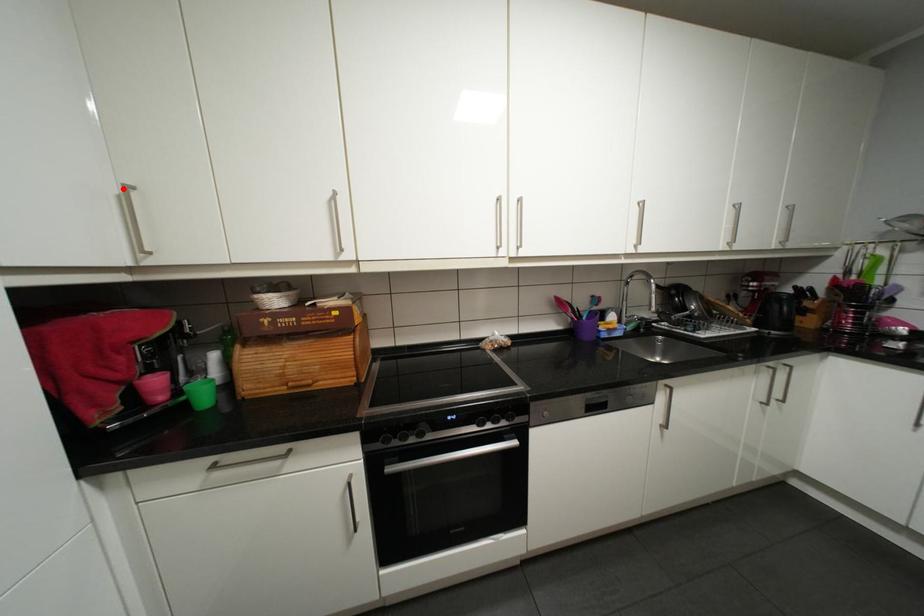
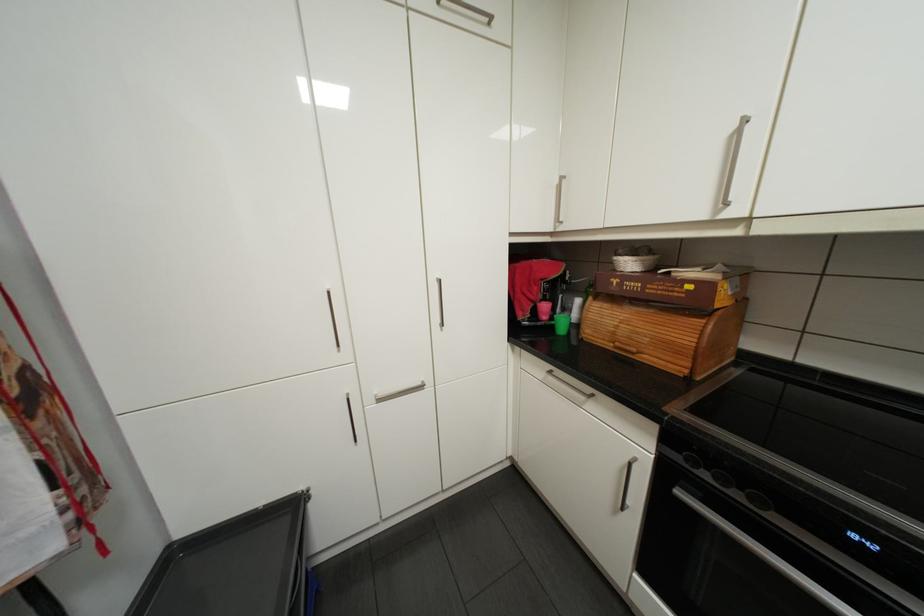
Question: I am providing you with two images of the same scene from different viewpoints. A red point is shown in image1. For the corresponding object point in image2, is it positioned nearer or farther from the camera?

Choices:
 (A) Nearer
 (B) Farther

Answer: (A)